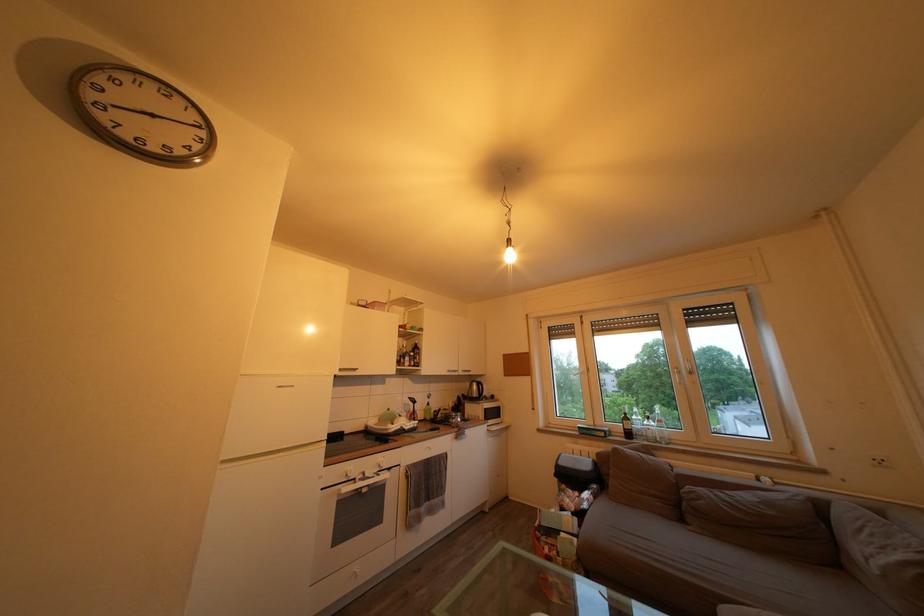
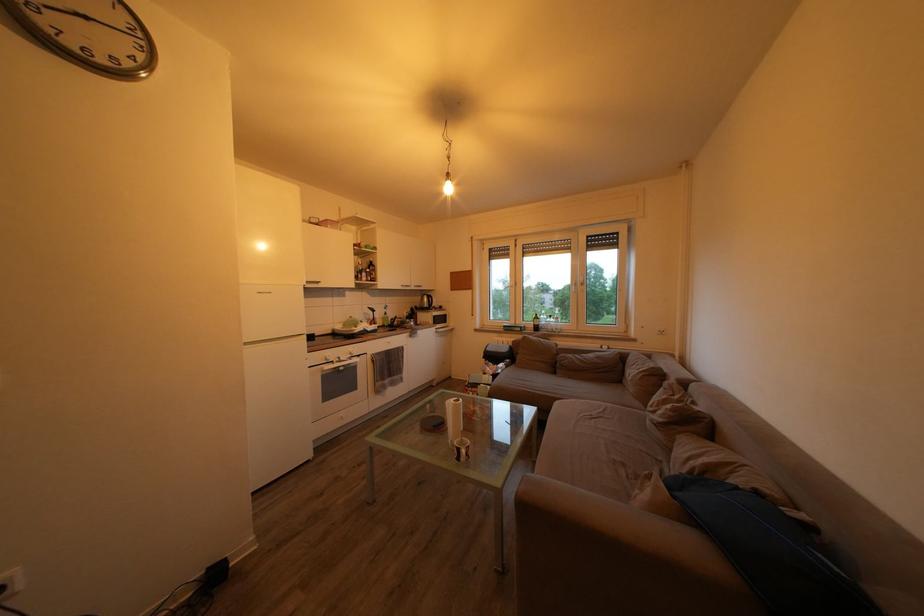
In the second image, find the point that corresponds to [502,419] in the first image.

(448, 326)